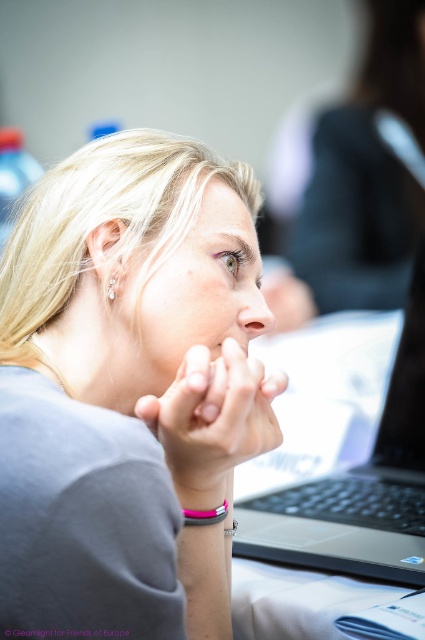
You are organizing a virtual meeting and need to place a 12 inch wide monitor between the sleek black laptop at center and the silver metallic bracelet at lower center. Is there enough space to fit it without overlapping either object?

The distance between the sleek black laptop at center and the silver metallic bracelet at lower center is 13.39 inches. Since the monitor is 12 inches wide, there is enough space to fit it between them without overlapping either object.

You are a photographer adjusting your camera settings to focus on two points in the image. The first point is point (28, 467) and the second is point (231, 529). According to the scene description, which point should you focus on first to ensure the woman in the foreground is sharp?

Point (28, 467) is in front of point (231, 529), so focusing on point (28, 467) first will ensure the woman in the foreground is sharp.